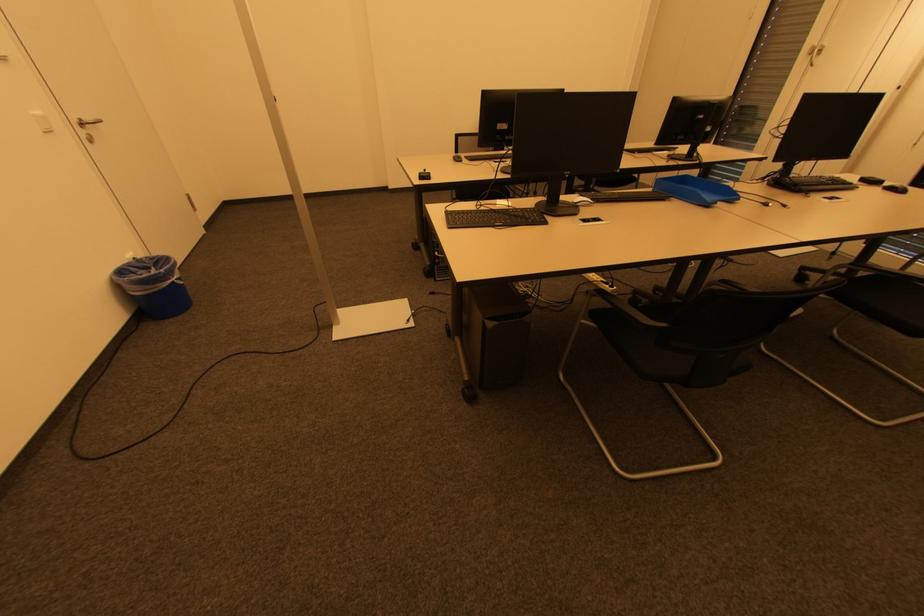
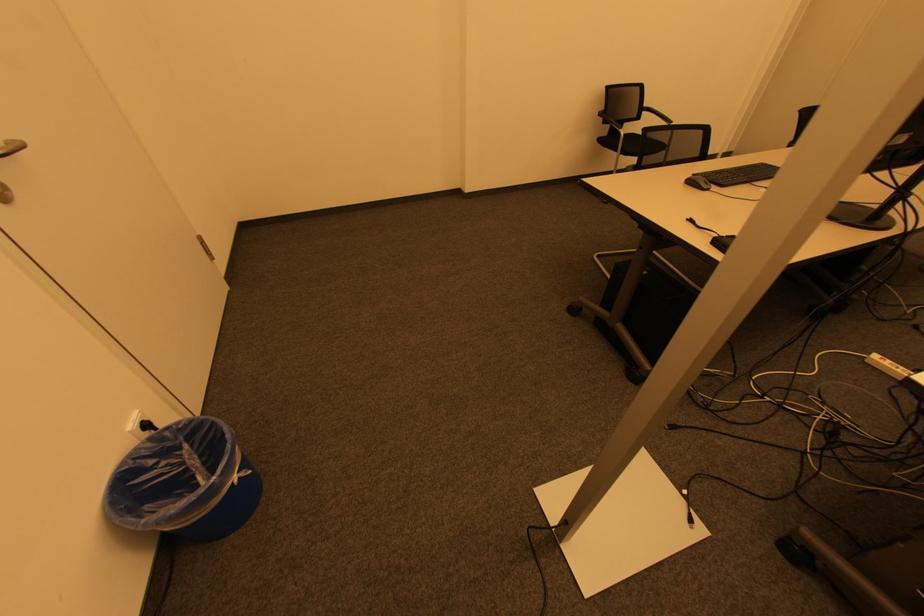
What movement of the cameraman would produce the second image?

The cameraman walked toward left, forward.